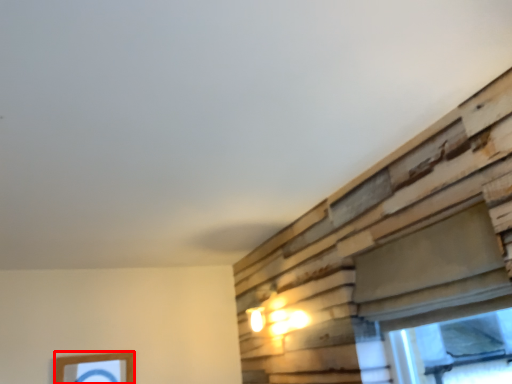
Question: From the image's perspective, where is picture frame (annotated by the red box) located in relation to window in the image?

Choices:
 (A) below
 (B) above

Answer: (A)